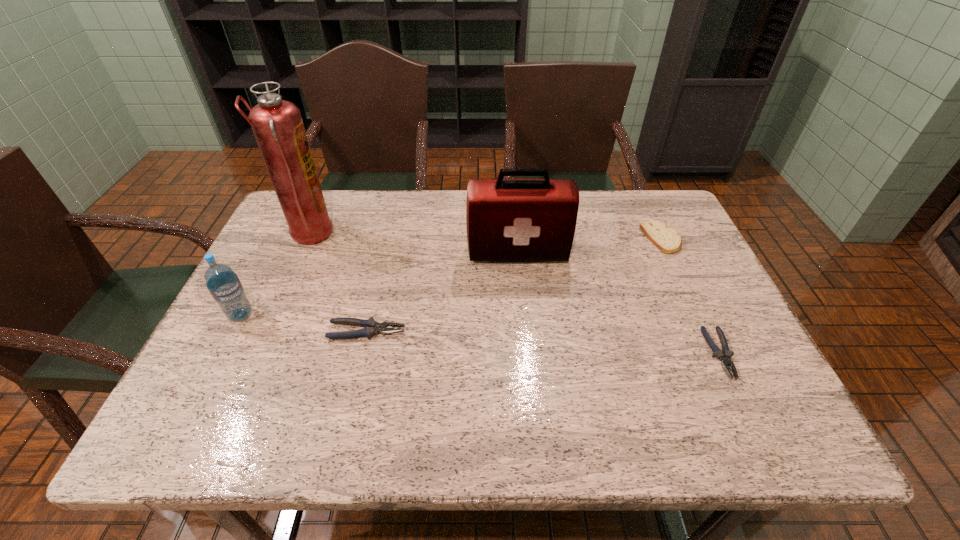
At what (x,y) coordinates should I click in order to perform the action: click on unoccupied position between the fire extinguisher and the second tallest object. Please return your answer as a coordinate pair (x, y). The height and width of the screenshot is (540, 960). Looking at the image, I should click on (414, 244).

At what (x,y) coordinates should I click in order to perform the action: click on unoccupied area between the water bottle and the right pliers. Please return your answer as a coordinate pair (x, y). Looking at the image, I should click on (480, 334).

You are a GUI agent. You are given a task and a screenshot of the screen. Output one action in this format:
    pyautogui.click(x=<x>, y=<y>)
    Task: Click on the free point between the right pliers and the fifth shortest object
    
    Given the screenshot: What is the action you would take?
    click(x=619, y=303)

The image size is (960, 540). In order to click on free space between the fire extinguisher and the fourth shortest object in this screenshot , I will do `click(275, 275)`.

At what (x,y) coordinates should I click in order to perform the action: click on free space between the fire extinguisher and the third tallest object. Please return your answer as a coordinate pair (x, y). The height and width of the screenshot is (540, 960). Looking at the image, I should click on (275, 275).

The image size is (960, 540). Identify the location of unoccupied position between the taller pliers and the tallest object. (338, 284).

Identify the location of vacant area between the taller pliers and the pita bread. (515, 285).

I want to click on free spot between the shorter pliers and the tallest object, so click(x=515, y=294).

Identify which object is located as the fifth nearest to the tallest object. Please provide its 2D coordinates. Your answer should be formatted as a tuple, i.e. [(x, y)], where the tuple contains the x and y coordinates of a point satisfying the conditions above.

[(725, 357)]

I want to click on the closest object to the right pliers, so click(x=666, y=239).